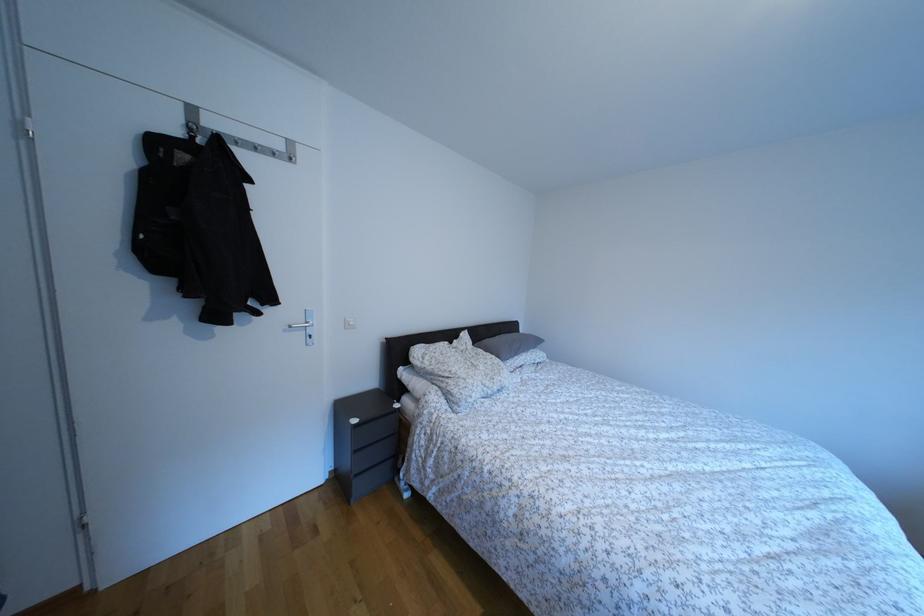
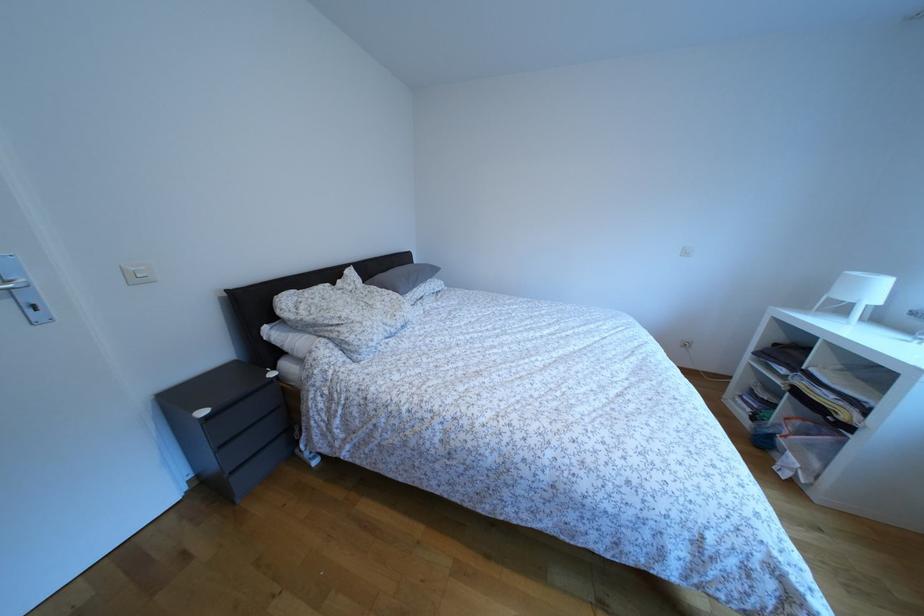
The first image is from the beginning of the video and the second image is from the end. How did the camera likely rotate when shooting the video?

The rotation direction of the camera is right-down.